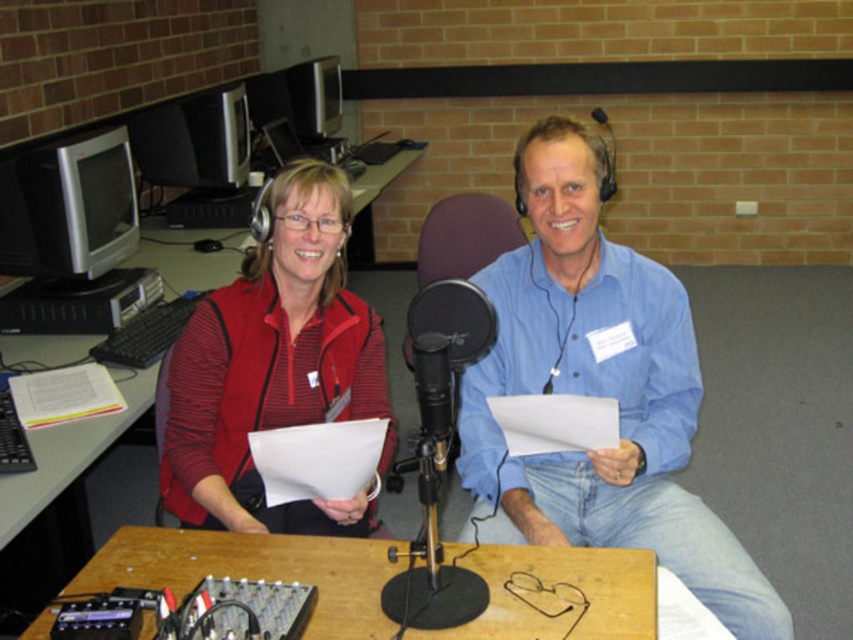
You are standing in the studio and want to place a small decorative item on the surface between the blue cotton shirt at center and the wooden table at center. Considering their positions, which object should you place it closer to?

The blue cotton shirt at center has a greater height compared to the wooden table at center, so you should place the decorative item closer to the wooden table at center to ensure stability.

You are standing in the radio studio and want to move from your current position to the microphone. There are two points marked in the scene. The first point is at coordinates point (361, 627) and the second point is at point (612, 161). Which point should you move towards to reach the microphone more quickly?

Point (361, 627) is in front of point (612, 161), so moving towards point (361, 627) would allow you to reach the microphone more quickly as it is closer to your current position.